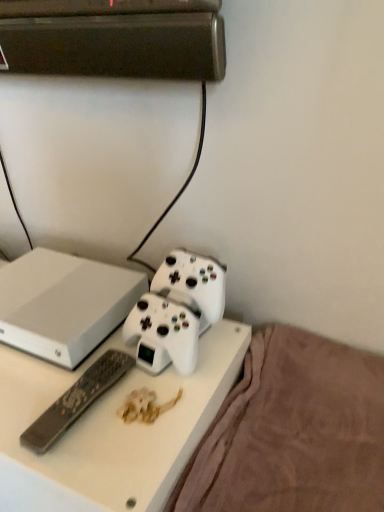
Where is `vacant point above white matte gaming console at center (from a real-world perspective)`? vacant point above white matte gaming console at center (from a real-world perspective) is located at coordinates (38, 284).